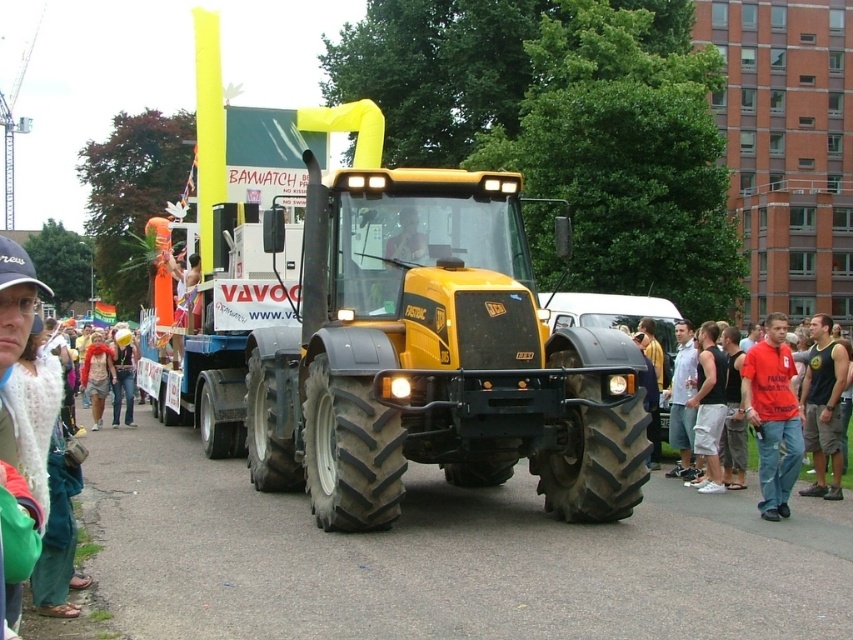
Is yellow matte tractor at center closer to camera compared to black tank top at right?

Yes.

Is yellow matte tractor at center smaller than black tank top at right?

Incorrect, yellow matte tractor at center is not smaller in size than black tank top at right.

Image resolution: width=853 pixels, height=640 pixels. Find the location of `yellow matte tractor at center`. yellow matte tractor at center is located at coordinates (415, 352).

Does yellow matte tractor at center have a larger size compared to white cotton shirt at center?

Yes.

In the scene shown: Can you confirm if yellow matte tractor at center is shorter than white cotton shirt at center?

No, yellow matte tractor at center is not shorter than white cotton shirt at center.

This screenshot has width=853, height=640. What do you see at coordinates (415, 352) in the screenshot?
I see `yellow matte tractor at center` at bounding box center [415, 352].

This screenshot has width=853, height=640. Identify the location of yellow matte tractor at center. (415, 352).

From the picture: Does red cotton shirt at lower right appear under black tank top at right?

Correct, red cotton shirt at lower right is located below black tank top at right.

Is red cotton shirt at lower right further to camera compared to black tank top at right?

That is False.

Describe the element at coordinates (773, 416) in the screenshot. I see `red cotton shirt at lower right` at that location.

Image resolution: width=853 pixels, height=640 pixels. Find the location of `red cotton shirt at lower right`. red cotton shirt at lower right is located at coordinates (773, 416).